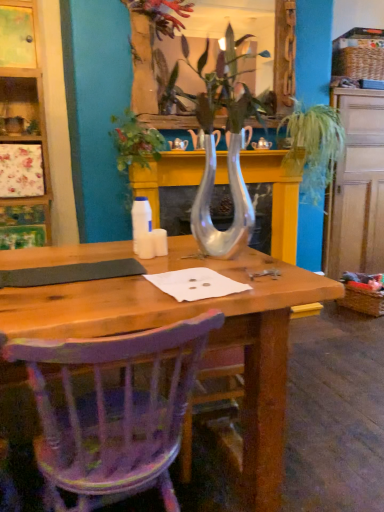
Question: Does point (299, 166) appear closer or farther from the camera than point (193, 340)?

Choices:
 (A) farther
 (B) closer

Answer: (A)

Question: Is green leafy plant at upper right to the left or to the right of purple painted wood chair at lower left in the image?

Choices:
 (A) left
 (B) right

Answer: (B)

Question: Which is nearer to the woven straw picnic basket at lower right?

Choices:
 (A) green leafy plant at center
 (B) metallic silver flower at upper center
 (C) white glossy bottle at center
 (D) purple painted wood chair at lower left
 (E) green leafy plant at upper right

Answer: (E)

Question: Estimate the real-world distances between objects in this image. Which object is closer to the wooden dresser at right?

Choices:
 (A) green leafy plant at center
 (B) purple painted wood chair at lower left
 (C) metallic silver flower at upper center
 (D) white glossy bottle at center
 (E) green leafy plant at upper right

Answer: (E)